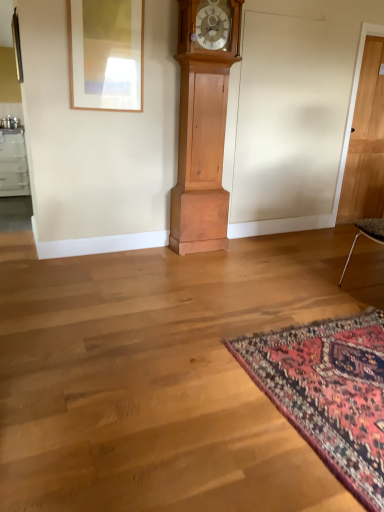
Question: Is matte wooden picture frame at upper left far away from carpet with intricate patterns at lower right?

Choices:
 (A) no
 (B) yes

Answer: (B)

Question: Is matte wooden picture frame at upper left positioned beyond the bounds of carpet with intricate patterns at lower right?

Choices:
 (A) yes
 (B) no

Answer: (A)

Question: Is matte wooden picture frame at upper left placed right next to carpet with intricate patterns at lower right?

Choices:
 (A) no
 (B) yes

Answer: (A)

Question: Does matte wooden picture frame at upper left have a greater width compared to carpet with intricate patterns at lower right?

Choices:
 (A) no
 (B) yes

Answer: (A)

Question: Is matte wooden picture frame at upper left in front of carpet with intricate patterns at lower right?

Choices:
 (A) yes
 (B) no

Answer: (B)

Question: Could carpet with intricate patterns at lower right be considered to be inside matte wooden picture frame at upper left?

Choices:
 (A) yes
 (B) no

Answer: (B)

Question: Does matte wooden picture frame at upper left touch light brown wooden door at right?

Choices:
 (A) no
 (B) yes

Answer: (A)

Question: Does matte wooden picture frame at upper left have a smaller size compared to light brown wooden door at right?

Choices:
 (A) no
 (B) yes

Answer: (B)

Question: From the image's perspective, would you say matte wooden picture frame at upper left is shown under light brown wooden door at right?

Choices:
 (A) no
 (B) yes

Answer: (A)

Question: From a real-world perspective, is matte wooden picture frame at upper left on light brown wooden door at right?

Choices:
 (A) yes
 (B) no

Answer: (A)

Question: Can you confirm if matte wooden picture frame at upper left is taller than light brown wooden door at right?

Choices:
 (A) yes
 (B) no

Answer: (B)

Question: Is matte wooden picture frame at upper left outside of light brown wooden door at right?

Choices:
 (A) no
 (B) yes

Answer: (B)

Question: Is light brown wood grandfather clock at center far from matte wooden picture frame at upper left?

Choices:
 (A) yes
 (B) no

Answer: (B)